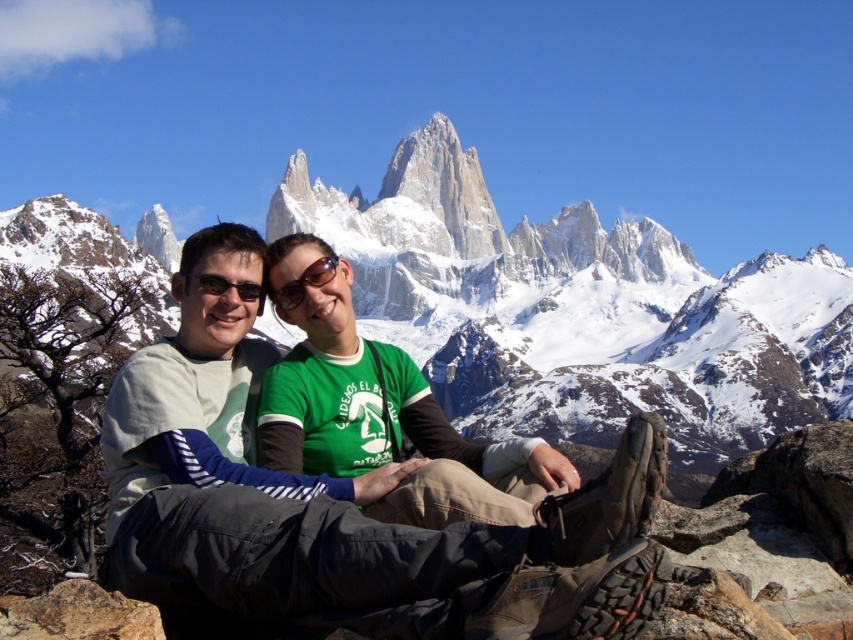
Question: Which point is farther to the camera?

Choices:
 (A) (277, 289)
 (B) (343, 532)
 (C) (299, 150)
 (D) (202, 288)

Answer: (C)

Question: Among these points, which one is nearest to the camera?

Choices:
 (A) (320, 275)
 (B) (485, 540)
 (C) (407, 140)

Answer: (B)

Question: Is light gray fabric pants at center bigger than black plastic sunglasses at center?

Choices:
 (A) no
 (B) yes

Answer: (B)

Question: Which object is farther from the camera taking this photo?

Choices:
 (A) light gray fabric pants at center
 (B) brown rough rock at lower left
 (C) black plastic sunglasses at center
 (D) green matte sunglasses at center

Answer: (D)

Question: Is brown rough rock at lower left bigger than black plastic sunglasses at center?

Choices:
 (A) yes
 (B) no

Answer: (A)

Question: Does green matte sunglasses at center have a larger size compared to black plastic sunglasses at center?

Choices:
 (A) no
 (B) yes

Answer: (B)